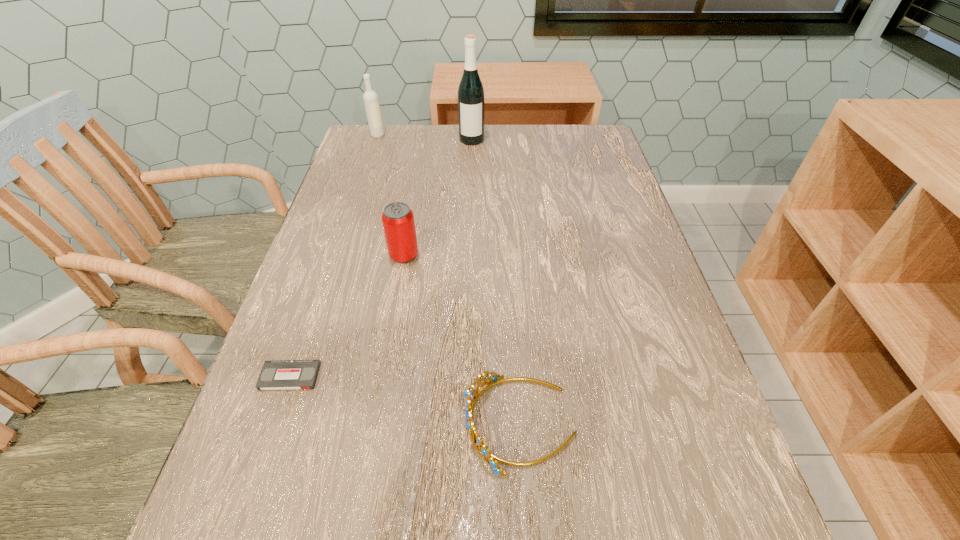
The image size is (960, 540). What are the coordinates of `blank region between the fourth shortest object and the shortest object` in the screenshot? It's located at pyautogui.click(x=334, y=256).

Where is `free spot between the videotape and the tallest object`? free spot between the videotape and the tallest object is located at coordinates (381, 258).

Where is `vacant space in between the vodka and the third farthest object`? This screenshot has width=960, height=540. vacant space in between the vodka and the third farthest object is located at coordinates (391, 195).

Where is `the closest object to the videotape`? the closest object to the videotape is located at coordinates (491, 379).

Select which object is the fourth closest to the shortest object. Please provide its 2D coordinates. Your answer should be formatted as a tuple, i.e. [(x, y)], where the tuple contains the x and y coordinates of a point satisfying the conditions above.

[(370, 97)]

Image resolution: width=960 pixels, height=540 pixels. In order to click on free space that satisfies the following two spatial constraints: 1. on the back side of the third object from left to right; 2. on the left side of the shortest object in this screenshot , I will do `click(331, 255)`.

I want to click on free location that satisfies the following two spatial constraints: 1. on the front side of the vodka; 2. on the right side of the third object from right to left, so click(338, 255).